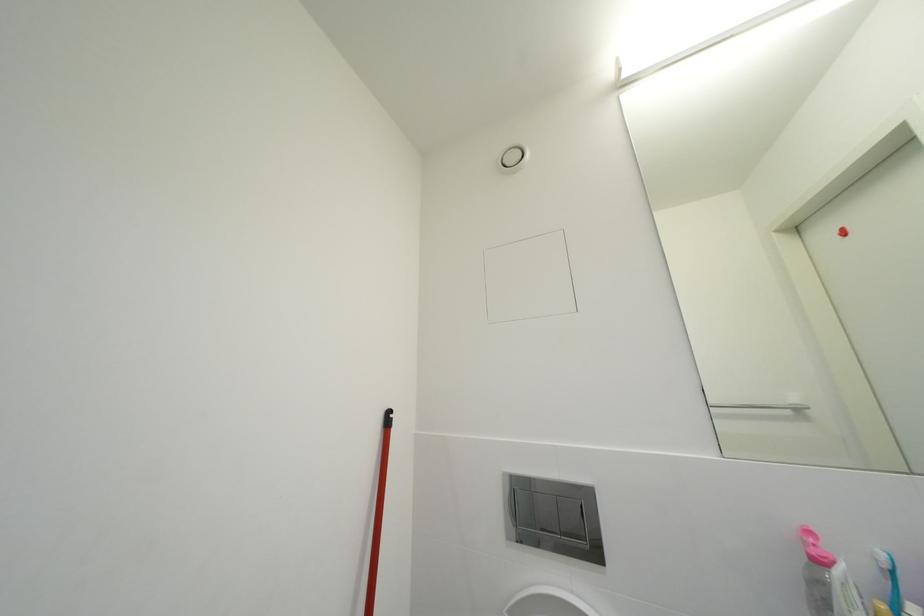
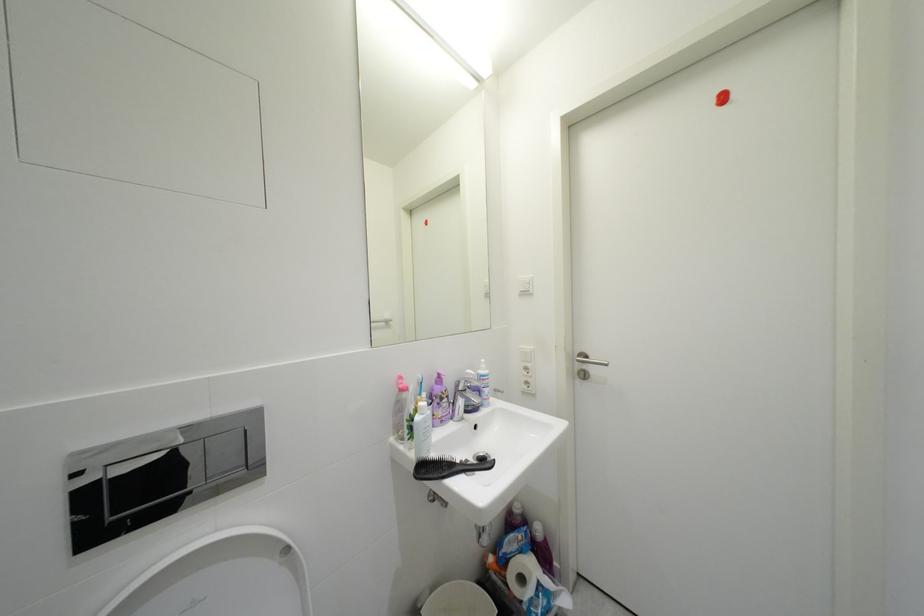
Question: Based on the continuous images, in which direction is the camera rotating? Reply with the corresponding letter.

Choices:
 (A) Left
 (B) Right
 (C) Up
 (D) Down

Answer: (B)